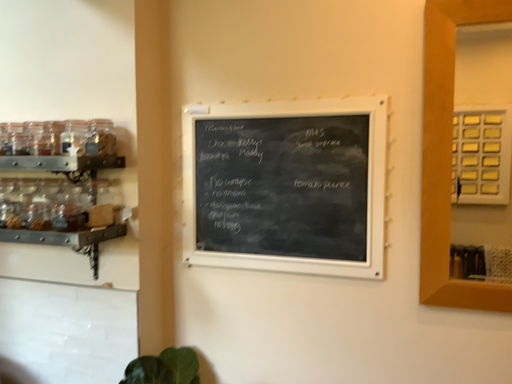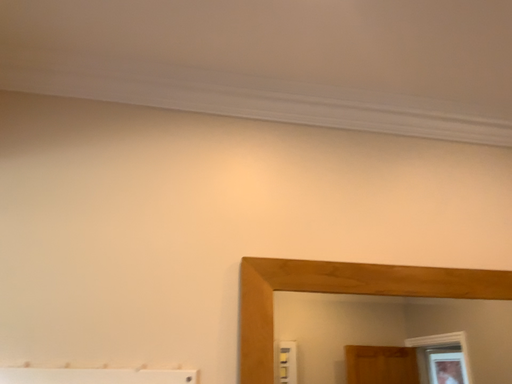
Question: How did the camera likely rotate when shooting the video?

Choices:
 (A) rotated upward
 (B) rotated downward

Answer: (A)